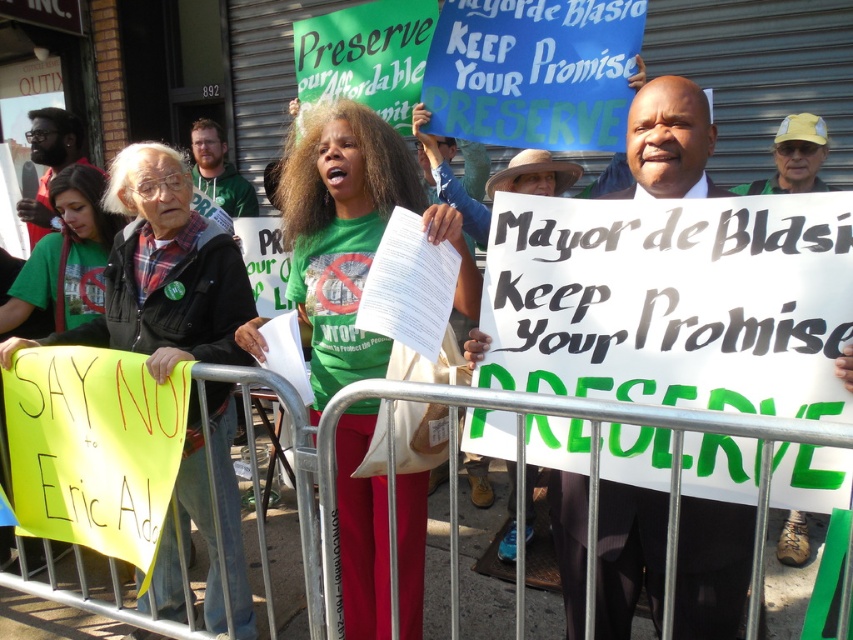
Based on the scene described, which object is wider when comparing the white paper sign at center and the green fabric shirt at lower left?

The white paper sign at center is wider than the green fabric shirt at lower left.

You are a photographer at the protest. You want to capture a photo that shows both the green fabric shirt at center and the white paper sign at center clearly. Based on their positions, which object should you focus on first to ensure both are in focus?

The green fabric shirt at center is above the white paper sign at center, so focusing on the green fabric shirt at center first will ensure both are in focus as the white paper sign at center is below it.